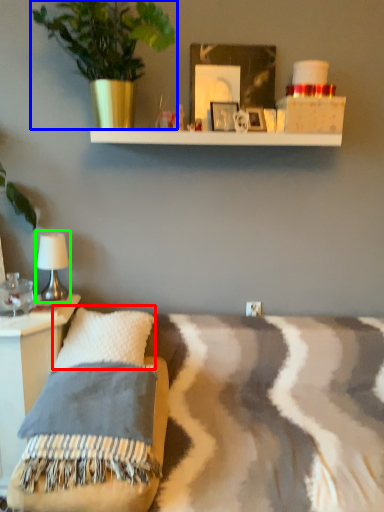
Question: Which object is positioned farthest from pillow (highlighted by a red box)? Select from houseplant (highlighted by a blue box) and table lamp (highlighted by a green box).

Choices:
 (A) houseplant
 (B) table lamp

Answer: (A)